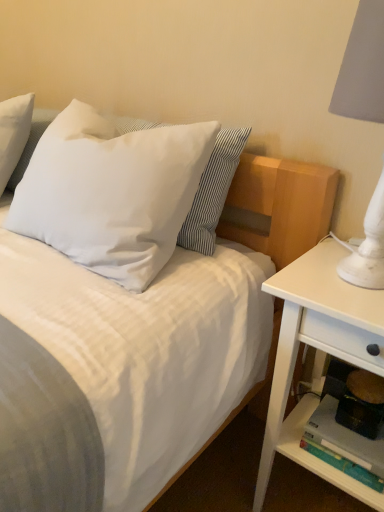
Question: In terms of height, does white matte pillow at upper left, positioned as the 2th pillow in right-to-left order, look taller or shorter compared to white wood nightstand at right?

Choices:
 (A) tall
 (B) short

Answer: (B)

Question: In the image, is white matte pillow at upper left, the 1th pillow in the left-to-right sequence, on the left side or the right side of white wood nightstand at right?

Choices:
 (A) right
 (B) left

Answer: (B)

Question: Which object is positioned farthest from the white wood nightstand at right?

Choices:
 (A) matte plastic shelf at lower right
 (B) white matte pillow at upper left, positioned as the 2th pillow in right-to-left order
 (C) white soft pillow at upper left, placed as the 1th pillow when sorted from right to left

Answer: (B)

Question: Estimate the real-world distances between objects in this image. Which object is farther from the white matte pillow at upper left, the 1th pillow in the left-to-right sequence?

Choices:
 (A) white soft pillow at upper left, placed as the 1th pillow when sorted from right to left
 (B) matte plastic shelf at lower right
 (C) white wood nightstand at right

Answer: (B)